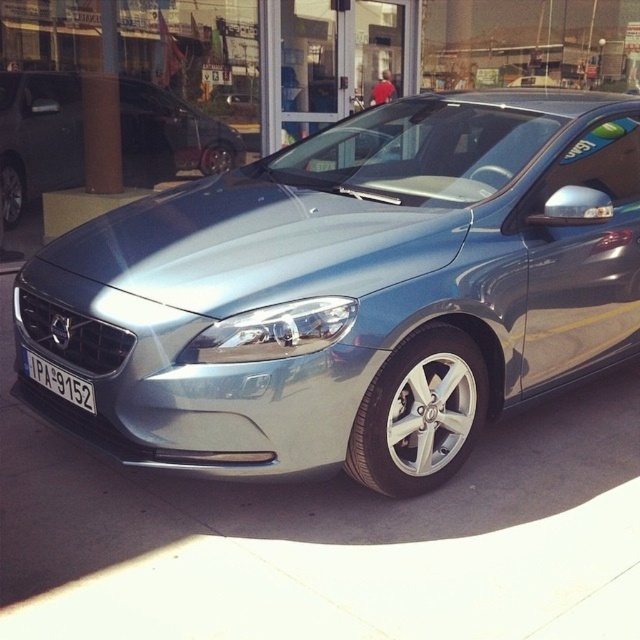
Question: Does satin metallic car at center appear under white plastic license plate at center?

Choices:
 (A) yes
 (B) no

Answer: (B)

Question: Is metallic pavement at lower center positioned in front of white plastic license plate at center?

Choices:
 (A) yes
 (B) no

Answer: (A)

Question: Based on their relative distances, which object is nearer to the white plastic license plate at center?

Choices:
 (A) metallic pavement at lower center
 (B) satin silver car at center

Answer: (A)

Question: Is satin silver car at center positioned before white plastic license plate at center?

Choices:
 (A) yes
 (B) no

Answer: (B)

Question: Which object is closer to the camera taking this photo?

Choices:
 (A) white plastic license plate at center
 (B) satin metallic car at center

Answer: (B)

Question: Which object is positioned farthest from the satin silver car at center?

Choices:
 (A) satin metallic car at center
 (B) metallic pavement at lower center

Answer: (A)